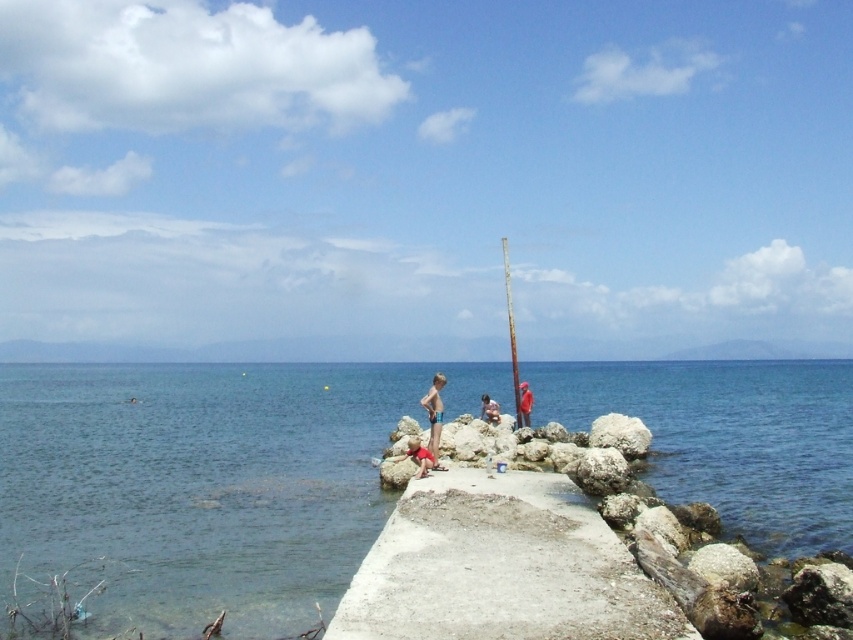
Question: Which object is farther from the camera taking this photo?

Choices:
 (A) smooth skin person at center
 (B) blue swim trunks at center
 (C) red fabric person at center
 (D) rusty metal pole at center

Answer: (D)

Question: Which point appears farthest from the camera in this image?

Choices:
 (A) (509, 333)
 (B) (437, 458)
 (C) (519, 413)
 (D) (490, 413)

Answer: (A)

Question: Can you confirm if blue swim trunks at center is wider than rusty metal pole at center?

Choices:
 (A) yes
 (B) no

Answer: (B)

Question: Is clear blue water at center above smooth skin person at center?

Choices:
 (A) no
 (B) yes

Answer: (A)

Question: Which of the following is the closest to the observer?

Choices:
 (A) (434, 444)
 (B) (421, 460)
 (C) (521, 412)

Answer: (B)

Question: Is rusty metal pole at center below red fabric person at center?

Choices:
 (A) yes
 (B) no

Answer: (B)